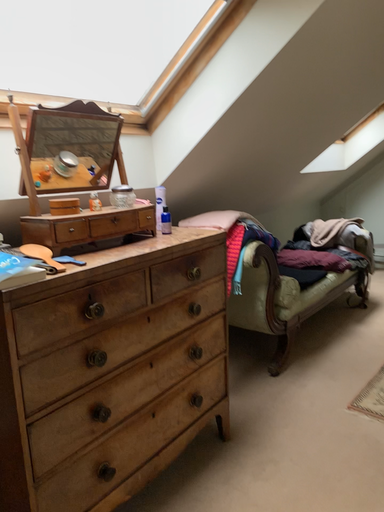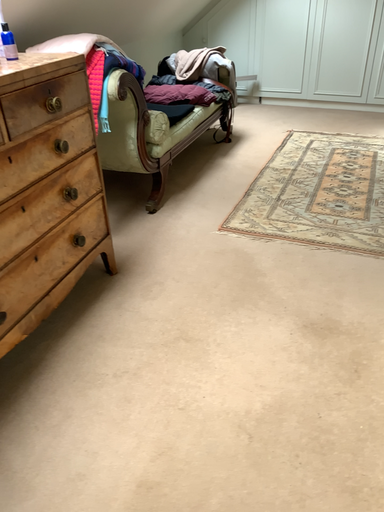
Question: How did the camera likely rotate when shooting the video?

Choices:
 (A) rotated upward
 (B) rotated downward

Answer: (B)